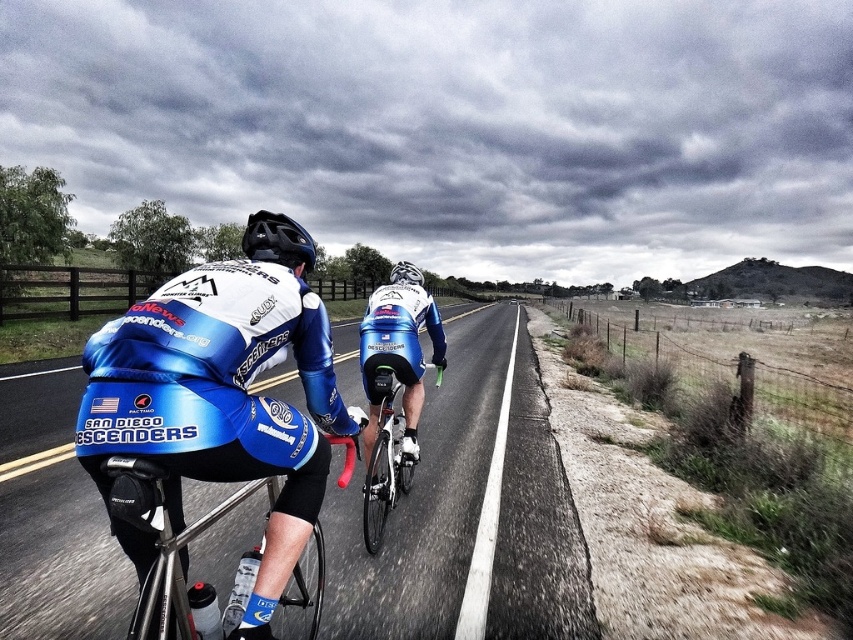
Locate an element on the screen. This screenshot has width=853, height=640. shiny metallic bicycle at center is located at coordinates (386, 460).

Between point (387, 378) and point (419, 272), which one is positioned in front?

Point (387, 378)

Is point (374, 548) farther from viewer compared to point (404, 282)?

No, (374, 548) is closer to viewer.

Locate an element on the screen. The width and height of the screenshot is (853, 640). shiny metallic bicycle at center is located at coordinates (386, 460).

Measure the distance from shiny black frame at center to matte black helmet at center.

The distance of shiny black frame at center from matte black helmet at center is 4.09 feet.

Does shiny black frame at center appear on the right side of matte black helmet at center?

Correct, you'll find shiny black frame at center to the right of matte black helmet at center.

Between point (194, 531) and point (311, 257), which one is positioned behind?

The point (311, 257) is more distant.

This screenshot has height=640, width=853. In order to click on shiny black frame at center in this screenshot , I will do (x=177, y=552).

The width and height of the screenshot is (853, 640). What do you see at coordinates (277, 241) in the screenshot? I see `matte black helmet at center` at bounding box center [277, 241].

Which is below, matte black helmet at center or white matte bicycle helmet at center?

Positioned lower is white matte bicycle helmet at center.

What do you see at coordinates (277, 241) in the screenshot? The image size is (853, 640). I see `matte black helmet at center` at bounding box center [277, 241].

Find the location of `matte black helmet at center`. matte black helmet at center is located at coordinates click(277, 241).